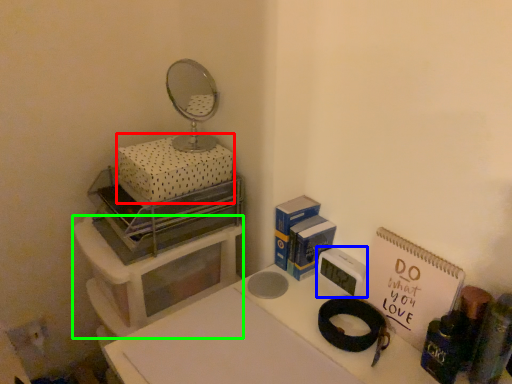
Question: Based on their relative distances, which object is nearer to box (highlighted by a red box)? Choose from appliance (highlighted by a blue box) and furniture (highlighted by a green box).

Choices:
 (A) appliance
 (B) furniture

Answer: (B)